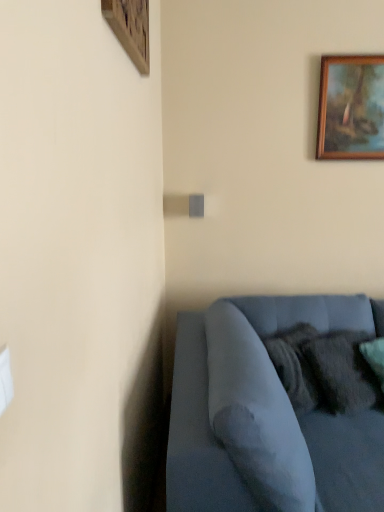
This screenshot has height=512, width=384. In order to click on velvety dark gray pillow at lower right in this screenshot , I will do `click(342, 372)`.

Locate an element on the screen. The width and height of the screenshot is (384, 512). velvet blue couch at lower right is located at coordinates (265, 416).

Describe the element at coordinates (265, 416) in the screenshot. I see `velvet blue couch at lower right` at that location.

The width and height of the screenshot is (384, 512). What do you see at coordinates (348, 106) in the screenshot?
I see `wooden picture frame at upper right, which is the 2th picture frame from front to back` at bounding box center [348, 106].

This screenshot has width=384, height=512. Identify the location of wooden picture frame at upper right, which is the 2th picture frame from front to back. (x=348, y=106).

Where is `velvety dark gray pillow at lower right`? This screenshot has width=384, height=512. velvety dark gray pillow at lower right is located at coordinates (342, 372).

Looking at this image, who is smaller, wooden picture frame at upper right, marked as the 1th picture frame in a back-to-front arrangement, or velvet blue couch at lower right?

wooden picture frame at upper right, marked as the 1th picture frame in a back-to-front arrangement, is smaller.

Could you measure the distance between wooden picture frame at upper right, the 1th picture frame positioned from the right, and velvet blue couch at lower right?

The distance of wooden picture frame at upper right, the 1th picture frame positioned from the right, from velvet blue couch at lower right is 4.25 feet.

Is wooden picture frame at upper right, marked as the 1th picture frame in a back-to-front arrangement, shorter than velvet blue couch at lower right?

Indeed, wooden picture frame at upper right, marked as the 1th picture frame in a back-to-front arrangement, has a lesser height compared to velvet blue couch at lower right.

Is wooden picture frame at upper right, the 1th picture frame positioned from the right, completely or partially outside of velvet blue couch at lower right?

Yes, wooden picture frame at upper right, the 1th picture frame positioned from the right, is not within velvet blue couch at lower right.

How distant is velvet blue couch at lower right from velvety dark gray pillow at lower right?

velvet blue couch at lower right and velvety dark gray pillow at lower right are 31.65 centimeters apart from each other.

Where is `studio couch located underneath the velvety dark gray pillow at lower right (from a real-world perspective)`? This screenshot has height=512, width=384. studio couch located underneath the velvety dark gray pillow at lower right (from a real-world perspective) is located at coordinates (265, 416).

Between velvet blue couch at lower right and velvety dark gray pillow at lower right, which one appears on the left side from the viewer's perspective?

velvet blue couch at lower right is more to the left.

Between velvet blue couch at lower right and velvety dark gray pillow at lower right, which one has less height?

velvety dark gray pillow at lower right is shorter.

Looking at their sizes, would you say wooden picture frame at upper left, which is the first picture frame in left-to-right order, is wider or thinner than wooden picture frame at upper right, which is the 2th picture frame from front to back?

In the image, wooden picture frame at upper left, which is the first picture frame in left-to-right order, appears to be more narrow than wooden picture frame at upper right, which is the 2th picture frame from front to back.

Is wooden picture frame at upper left, which is the first picture frame in left-to-right order, smaller than wooden picture frame at upper right, which is counted as the second picture frame, starting from the left?

Correct, wooden picture frame at upper left, which is the first picture frame in left-to-right order, occupies less space than wooden picture frame at upper right, which is counted as the second picture frame, starting from the left.

From the image's perspective, is wooden picture frame at upper left, which is counted as the 1th picture frame, starting from the front, above or below wooden picture frame at upper right, which is counted as the second picture frame, starting from the left?

Based on their image positions, wooden picture frame at upper left, which is counted as the 1th picture frame, starting from the front, is located beneath wooden picture frame at upper right, which is counted as the second picture frame, starting from the left.

Between wooden picture frame at upper right, marked as the 1th picture frame in a back-to-front arrangement, and velvety dark gray pillow at lower right, which one has larger width?

velvety dark gray pillow at lower right.

Is wooden picture frame at upper right, which is the 2th picture frame from front to back, oriented towards velvety dark gray pillow at lower right?

→ No, wooden picture frame at upper right, which is the 2th picture frame from front to back, is not aimed at velvety dark gray pillow at lower right.

Could you measure the distance between wooden picture frame at upper right, marked as the 1th picture frame in a back-to-front arrangement, and velvety dark gray pillow at lower right?

A distance of 1.27 meters exists between wooden picture frame at upper right, marked as the 1th picture frame in a back-to-front arrangement, and velvety dark gray pillow at lower right.

Who is shorter, wooden picture frame at upper right, the 1th picture frame positioned from the right, or velvety dark gray pillow at lower right?

velvety dark gray pillow at lower right is shorter.

Is point (345, 378) closer to camera compared to point (140, 44)?

No, (345, 378) is behind (140, 44).

Considering the sizes of objects velvety dark gray pillow at lower right and wooden picture frame at upper left, which is counted as the 2th picture frame, starting from the right, in the image provided, who is shorter, velvety dark gray pillow at lower right or wooden picture frame at upper left, which is counted as the 2th picture frame, starting from the right,?

wooden picture frame at upper left, which is counted as the 2th picture frame, starting from the right, is shorter.

Which of these two, velvety dark gray pillow at lower right or wooden picture frame at upper left, the 2th picture frame viewed from the back, is bigger?

Bigger between the two is velvety dark gray pillow at lower right.

Where is `picture frame on the right side of velvet blue couch at lower right`? The image size is (384, 512). picture frame on the right side of velvet blue couch at lower right is located at coordinates (348, 106).

From the image's perspective, is velvet blue couch at lower right located above or below wooden picture frame at upper right, which is counted as the second picture frame, starting from the left?

velvet blue couch at lower right is situated lower than wooden picture frame at upper right, which is counted as the second picture frame, starting from the left, in the image.

Could you tell me if velvet blue couch at lower right is turned towards wooden picture frame at upper right, which is counted as the second picture frame, starting from the left?

No, velvet blue couch at lower right is not facing towards wooden picture frame at upper right, which is counted as the second picture frame, starting from the left.

Can we say velvet blue couch at lower right lies outside wooden picture frame at upper right, the 1th picture frame positioned from the right?

Indeed, velvet blue couch at lower right is completely outside wooden picture frame at upper right, the 1th picture frame positioned from the right.

Which object is more forward, wooden picture frame at upper left, which is the first picture frame in left-to-right order, or velvety dark gray pillow at lower right?

wooden picture frame at upper left, which is the first picture frame in left-to-right order.

Is wooden picture frame at upper left, which is the first picture frame in left-to-right order, oriented towards velvety dark gray pillow at lower right?

No, wooden picture frame at upper left, which is the first picture frame in left-to-right order, is not facing towards velvety dark gray pillow at lower right.

The width and height of the screenshot is (384, 512). In order to click on pillow below the wooden picture frame at upper left, which is the first picture frame in left-to-right order (from a real-world perspective) in this screenshot , I will do `click(342, 372)`.

From a real-world perspective, who is located lower, wooden picture frame at upper left, the 2th picture frame viewed from the back, or velvety dark gray pillow at lower right?

velvety dark gray pillow at lower right is physically lower.

The height and width of the screenshot is (512, 384). Identify the location of studio couch lying below the wooden picture frame at upper right, marked as the 1th picture frame in a back-to-front arrangement (from the image's perspective). (265, 416).

Locate an element on the screen. The image size is (384, 512). studio couch below the velvety dark gray pillow at lower right (from a real-world perspective) is located at coordinates (265, 416).

From the image, which object appears to be nearer to velvet blue couch at lower right, wooden picture frame at upper right, the 1th picture frame positioned from the right, or wooden picture frame at upper left, which is counted as the 1th picture frame, starting from the front?

wooden picture frame at upper left, which is counted as the 1th picture frame, starting from the front.

Looking at the image, which one is located closer to velvet blue couch at lower right, wooden picture frame at upper left, which is counted as the 2th picture frame, starting from the right, or velvety dark gray pillow at lower right?

velvety dark gray pillow at lower right is positioned closer to the anchor velvet blue couch at lower right.

Considering their positions, is velvet blue couch at lower right positioned closer to wooden picture frame at upper right, the 1th picture frame positioned from the right, than wooden picture frame at upper left, the 2th picture frame viewed from the back?

velvet blue couch at lower right is positioned closer to the anchor wooden picture frame at upper right, the 1th picture frame positioned from the right.

Consider the image. When comparing their distances from wooden picture frame at upper left, the 2th picture frame viewed from the back, does velvet blue couch at lower right or velvety dark gray pillow at lower right seem further?

Based on the image, velvety dark gray pillow at lower right appears to be further to wooden picture frame at upper left, the 2th picture frame viewed from the back.

When comparing their distances from wooden picture frame at upper right, marked as the 1th picture frame in a back-to-front arrangement, does wooden picture frame at upper left, which is the first picture frame in left-to-right order, or velvet blue couch at lower right seem closer?

velvet blue couch at lower right is positioned closer to the anchor wooden picture frame at upper right, marked as the 1th picture frame in a back-to-front arrangement.

Considering their positions, is velvet blue couch at lower right positioned closer to velvety dark gray pillow at lower right than wooden picture frame at upper right, marked as the 1th picture frame in a back-to-front arrangement?

velvet blue couch at lower right lies closer to velvety dark gray pillow at lower right than the other object.

Considering their positions, is wooden picture frame at upper left, which is the first picture frame in left-to-right order, positioned further to wooden picture frame at upper right, the 1th picture frame positioned from the right, than velvety dark gray pillow at lower right?

Among the two, wooden picture frame at upper left, which is the first picture frame in left-to-right order, is located further to wooden picture frame at upper right, the 1th picture frame positioned from the right.

When comparing their distances from wooden picture frame at upper left, which is the first picture frame in left-to-right order, does velvety dark gray pillow at lower right or velvet blue couch at lower right seem closer?

velvet blue couch at lower right.

Locate an element on the screen. The image size is (384, 512). picture frame between wooden picture frame at upper right, which is the 2th picture frame from front to back, and velvety dark gray pillow at lower right vertically is located at coordinates (130, 28).

You are a GUI agent. You are given a task and a screenshot of the screen. Output one action in this format:
    pyautogui.click(x=<x>, y=<y>)
    Task: Click on the picture frame between wooden picture frame at upper right, which is the 2th picture frame from front to back, and velvet blue couch at lower right, in the vertical direction
    This screenshot has height=512, width=384.
    Given the screenshot: What is the action you would take?
    pyautogui.click(x=130, y=28)

Locate an element on the screen. This screenshot has width=384, height=512. pillow between wooden picture frame at upper right, which is counted as the second picture frame, starting from the left, and velvet blue couch at lower right, in the vertical direction is located at coordinates (342, 372).

Where is `pillow between wooden picture frame at upper left, which is counted as the 1th picture frame, starting from the front, and velvet blue couch at lower right, in the vertical direction`? pillow between wooden picture frame at upper left, which is counted as the 1th picture frame, starting from the front, and velvet blue couch at lower right, in the vertical direction is located at coordinates (342, 372).